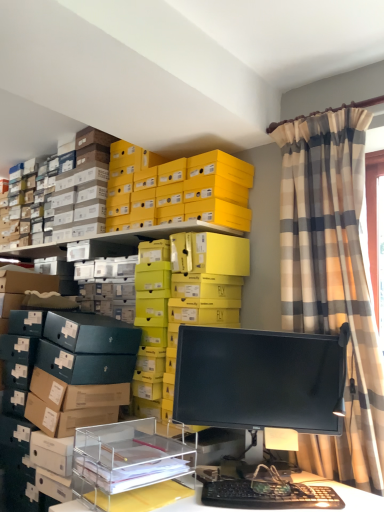
What do you see at coordinates (332, 279) in the screenshot? This screenshot has height=512, width=384. I see `plaid fabric curtain at upper right` at bounding box center [332, 279].

Find the location of `plaid fabric curtain at upper right`. plaid fabric curtain at upper right is located at coordinates (332, 279).

The image size is (384, 512). I want to click on yellow cardboard boxes at upper center, the 1th shelf positioned from the back, so click(206, 280).

What is the approximate width of yellow cardboard boxes at upper center, the 1th shelf positioned from the back?

15.30 inches.

You are a GUI agent. You are given a task and a screenshot of the screen. Output one action in this format:
    pyautogui.click(x=<x>, y=<y>)
    Task: Click on the yellow matte shoebox at upper center
    This screenshot has width=384, height=512.
    Given the screenshot: What is the action you would take?
    pyautogui.click(x=183, y=193)

Is yellow matte shoebox at upper center not close to yellow cardboard boxes at upper center, the second shelf viewed from the front?

They are positioned close to each other.

How different are the orientations of yellow matte shoebox at upper center and yellow cardboard boxes at upper center, the 1th shelf positioned from the back, in degrees?

Answer: The angle between the facing direction of yellow matte shoebox at upper center and the facing direction of yellow cardboard boxes at upper center, the 1th shelf positioned from the back, is 0.00213 degrees.

Does yellow matte shoebox at upper center turn towards yellow cardboard boxes at upper center, the second shelf viewed from the front?

No.

Based on the photo, do you think yellow matte shoebox at upper center is within yellow cardboard boxes at upper center, the second shelf viewed from the front, or outside of it?

yellow matte shoebox at upper center exists outside the volume of yellow cardboard boxes at upper center, the second shelf viewed from the front.

In the scene shown: Can black plastic keyboard at lower center be found inside yellow cardboard boxes at upper center, the 1th shelf positioned from the back?

No, black plastic keyboard at lower center is located outside of yellow cardboard boxes at upper center, the 1th shelf positioned from the back.

Considering the relative sizes of yellow cardboard boxes at upper center, the second shelf viewed from the front, and black plastic keyboard at lower center in the image provided, is yellow cardboard boxes at upper center, the second shelf viewed from the front, taller than black plastic keyboard at lower center?

Indeed, yellow cardboard boxes at upper center, the second shelf viewed from the front, has a greater height compared to black plastic keyboard at lower center.

Between point (217, 313) and point (272, 495), which one is positioned in front?

The point (272, 495) is closer.

Would you consider yellow cardboard boxes at upper center, the 1th shelf positioned from the back, to be distant from black plastic keyboard at lower center?

No, yellow cardboard boxes at upper center, the 1th shelf positioned from the back, is in close proximity to black plastic keyboard at lower center.

Does black glossy monitor at center have a greater width compared to yellow cardboard boxes at upper center, the second shelf viewed from the front?

No.

Considering the positions of points (223, 388) and (171, 344), is point (223, 388) closer to camera compared to point (171, 344)?

Yes, point (223, 388) is closer to viewer.

From a real-world perspective, which object rests below the other?

In real-world perspective, black glossy monitor at center is lower.

Is black glossy monitor at center directly adjacent to yellow cardboard boxes at upper center, the 1th shelf positioned from the back?

No, black glossy monitor at center is not beside yellow cardboard boxes at upper center, the 1th shelf positioned from the back.

Could you measure the distance between clear acrylic organizer at lower center, the 2th shelf when ordered from back to front, and black plastic keyboard at lower center?

They are 28.82 centimeters apart.

Is clear acrylic organizer at lower center, which is counted as the first shelf, starting from the front, positioned with its back to black plastic keyboard at lower center?

clear acrylic organizer at lower center, which is counted as the first shelf, starting from the front, is not turned away from black plastic keyboard at lower center.

Based on the photo, what's the angular difference between clear acrylic organizer at lower center, which is counted as the first shelf, starting from the front, and black plastic keyboard at lower center's facing directions?

39.9 degrees separate the facing orientations of clear acrylic organizer at lower center, which is counted as the first shelf, starting from the front, and black plastic keyboard at lower center.

Consider the image. Can we say clear acrylic organizer at lower center, which is counted as the first shelf, starting from the front, lies outside black plastic keyboard at lower center?

That's correct, clear acrylic organizer at lower center, which is counted as the first shelf, starting from the front, is outside of black plastic keyboard at lower center.

Is yellow matte shoebox at upper center positioned with its back to black plastic keyboard at lower center?

yellow matte shoebox at upper center is not turned away from black plastic keyboard at lower center.

Between yellow matte shoebox at upper center and black plastic keyboard at lower center, which one has smaller size?

black plastic keyboard at lower center.

Is point (240, 226) less distant than point (317, 503)?

No, (240, 226) is further to viewer.

Measure the distance from yellow matte shoebox at upper center to black plastic keyboard at lower center.

yellow matte shoebox at upper center is 1.23 meters from black plastic keyboard at lower center.

Does plaid fabric curtain at upper right have a lesser width compared to clear acrylic organizer at lower center, the 2th shelf when ordered from back to front?

Yes, plaid fabric curtain at upper right is thinner than clear acrylic organizer at lower center, the 2th shelf when ordered from back to front.

Considering the positions of points (372, 365) and (85, 460), is point (372, 365) closer to camera compared to point (85, 460)?

No, it is not.

Which is more to the right, plaid fabric curtain at upper right or clear acrylic organizer at lower center, which is counted as the first shelf, starting from the front?

plaid fabric curtain at upper right.

Can you confirm if clear acrylic organizer at lower center, which is counted as the first shelf, starting from the front, is shorter than plaid fabric curtain at upper right?

Correct, clear acrylic organizer at lower center, which is counted as the first shelf, starting from the front, is not as tall as plaid fabric curtain at upper right.

Is the depth of clear acrylic organizer at lower center, the 2th shelf when ordered from back to front, less than that of plaid fabric curtain at upper right?

Yes, clear acrylic organizer at lower center, the 2th shelf when ordered from back to front, is closer to the camera.

Is clear acrylic organizer at lower center, which is counted as the first shelf, starting from the front, far away from plaid fabric curtain at upper right?

That's not correct — clear acrylic organizer at lower center, which is counted as the first shelf, starting from the front, is a little close to plaid fabric curtain at upper right.

From a real-world perspective, which is physically above, clear acrylic organizer at lower center, which is counted as the first shelf, starting from the front, or plaid fabric curtain at upper right?

From a 3D spatial view, plaid fabric curtain at upper right is above.

The height and width of the screenshot is (512, 384). What are the coordinates of `shelf that is the 1st one below the yellow matte shoebox at upper center (from a real-world perspective)` in the screenshot? It's located at (206, 280).

Where is `computer keyboard in front of the yellow cardboard boxes at upper center, the 1th shelf positioned from the back`? computer keyboard in front of the yellow cardboard boxes at upper center, the 1th shelf positioned from the back is located at coordinates (269, 496).

Consider the image. Estimate the real-world distances between objects in this image. Which object is further from clear acrylic organizer at lower center, which is counted as the first shelf, starting from the front, black plastic keyboard at lower center or plaid fabric curtain at upper right?

plaid fabric curtain at upper right is positioned further to the anchor clear acrylic organizer at lower center, which is counted as the first shelf, starting from the front.

From the image, which object appears to be nearer to yellow cardboard boxes at upper center, the 1th shelf positioned from the back, yellow matte shoebox at upper center or black glossy monitor at center?

Among the two, yellow matte shoebox at upper center is located nearer to yellow cardboard boxes at upper center, the 1th shelf positioned from the back.

From the image, which object appears to be nearer to yellow cardboard boxes at upper center, the 1th shelf positioned from the back, clear acrylic organizer at lower center, which is counted as the first shelf, starting from the front, or black plastic keyboard at lower center?

The object closer to yellow cardboard boxes at upper center, the 1th shelf positioned from the back, is clear acrylic organizer at lower center, which is counted as the first shelf, starting from the front.

Estimate the real-world distances between objects in this image. Which object is further from yellow matte shoebox at upper center, black plastic keyboard at lower center or plaid fabric curtain at upper right?

black plastic keyboard at lower center.

Considering their positions, is yellow matte shoebox at upper center positioned closer to clear acrylic organizer at lower center, which is counted as the first shelf, starting from the front, than black plastic keyboard at lower center?

black plastic keyboard at lower center.

From the image, which object appears to be nearer to plaid fabric curtain at upper right, clear acrylic organizer at lower center, the 2th shelf when ordered from back to front, or yellow matte shoebox at upper center?

The object closer to plaid fabric curtain at upper right is yellow matte shoebox at upper center.

Looking at the image, which one is located further to plaid fabric curtain at upper right, yellow cardboard boxes at upper center, the 1th shelf positioned from the back, or black plastic keyboard at lower center?

black plastic keyboard at lower center.

Consider the image. When comparing their distances from yellow matte shoebox at upper center, does black glossy monitor at center or black plastic keyboard at lower center seem closer?

Among the two, black glossy monitor at center is located nearer to yellow matte shoebox at upper center.

Identify the location of computer monitor between yellow matte shoebox at upper center and clear acrylic organizer at lower center, the 2th shelf when ordered from back to front, in the up-down direction. This screenshot has width=384, height=512. (260, 379).

Where is `curtain between yellow matte shoebox at upper center and black glossy monitor at center vertically`? This screenshot has width=384, height=512. curtain between yellow matte shoebox at upper center and black glossy monitor at center vertically is located at coordinates (332, 279).

At what (x,y) coordinates should I click in order to perform the action: click on computer monitor between yellow cardboard boxes at upper center, the second shelf viewed from the front, and black plastic keyboard at lower center, in the vertical direction. Please return your answer as a coordinate pair (x, y). Image resolution: width=384 pixels, height=512 pixels. Looking at the image, I should click on (260, 379).

Find the location of `computer keyboard between clear acrylic organizer at lower center, which is counted as the first shelf, starting from the front, and plaid fabric curtain at upper right, in the horizontal direction`. computer keyboard between clear acrylic organizer at lower center, which is counted as the first shelf, starting from the front, and plaid fabric curtain at upper right, in the horizontal direction is located at coordinates (269, 496).